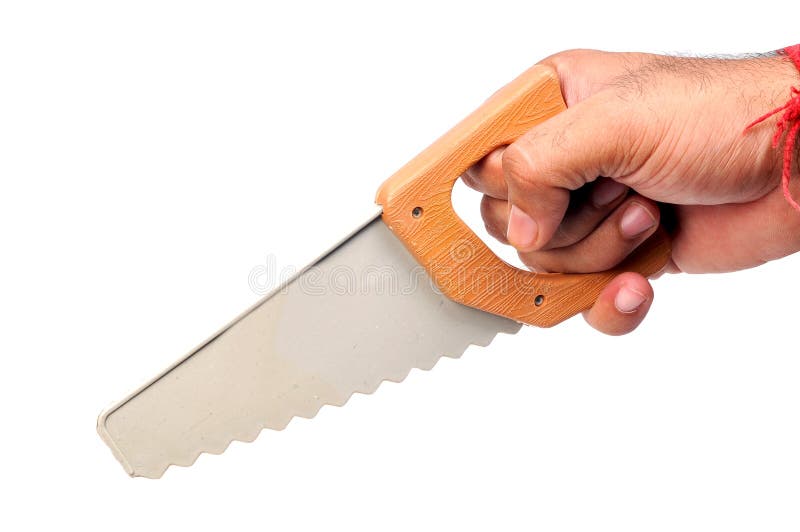
Identify the location of screw hole. click(x=536, y=299), click(x=413, y=218).